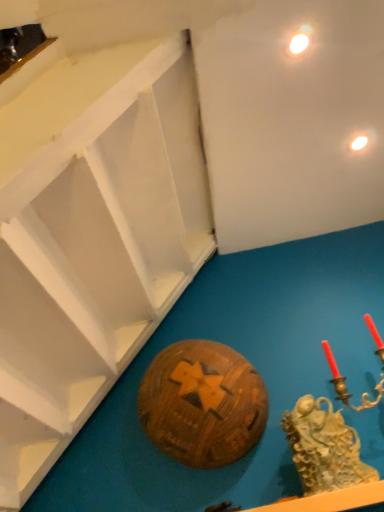
Question: From a real-world perspective, is matte white light at upper right, positioned as the second light in right-to-left order, located higher than wooden ball at center?

Choices:
 (A) yes
 (B) no

Answer: (A)

Question: Is matte white light at upper right, the second light when ordered from back to front, located outside wooden ball at center?

Choices:
 (A) no
 (B) yes

Answer: (B)

Question: Can you confirm if matte white light at upper right, the second light when ordered from back to front, is smaller than wooden ball at center?

Choices:
 (A) yes
 (B) no

Answer: (A)

Question: Does matte white light at upper right, positioned as the second light in right-to-left order, touch wooden ball at center?

Choices:
 (A) no
 (B) yes

Answer: (A)

Question: From the image's perspective, is matte white light at upper right, marked as the second light in a bottom-to-top arrangement, under wooden ball at center?

Choices:
 (A) no
 (B) yes

Answer: (A)

Question: Is matte white light at upper right, the second light when ordered from back to front, aimed at wooden ball at center?

Choices:
 (A) yes
 (B) no

Answer: (B)

Question: Does wooden ball at center turn towards matte white light at upper right, the 2th light from the front?

Choices:
 (A) no
 (B) yes

Answer: (A)

Question: Considering the relative positions of wooden ball at center and matte white light at upper right, the second light when ordered from top to bottom, in the image provided, is wooden ball at center to the left of matte white light at upper right, the second light when ordered from top to bottom, from the viewer's perspective?

Choices:
 (A) no
 (B) yes

Answer: (B)

Question: Is wooden ball at center located outside matte white light at upper right, acting as the 1th light starting from the back?

Choices:
 (A) yes
 (B) no

Answer: (A)

Question: Is wooden ball at center positioned with its back to matte white light at upper right, the 2th light from the front?

Choices:
 (A) yes
 (B) no

Answer: (B)

Question: From a real-world perspective, does wooden ball at center sit lower than matte white light at upper right, acting as the 1th light starting from the back?

Choices:
 (A) yes
 (B) no

Answer: (A)

Question: Does wooden ball at center come behind matte white light at upper right, arranged as the 1th light when viewed from the right?

Choices:
 (A) yes
 (B) no

Answer: (B)

Question: Does gold textured sculpture at lower right have a lesser height compared to matte white light at upper right, acting as the 1th light starting from the back?

Choices:
 (A) no
 (B) yes

Answer: (A)